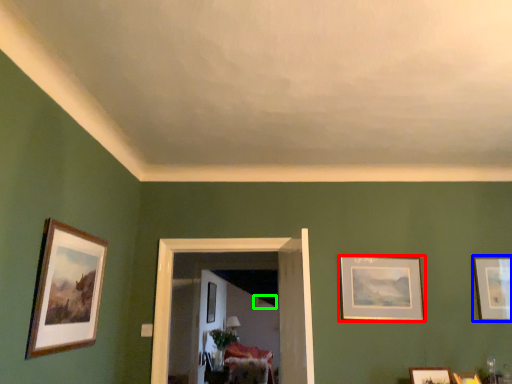
Question: Which object is the closest to the picture frame (highlighted by a red box)? Choose among these: picture frame (highlighted by a blue box) or picture frame (highlighted by a green box).

Choices:
 (A) picture frame
 (B) picture frame

Answer: (A)